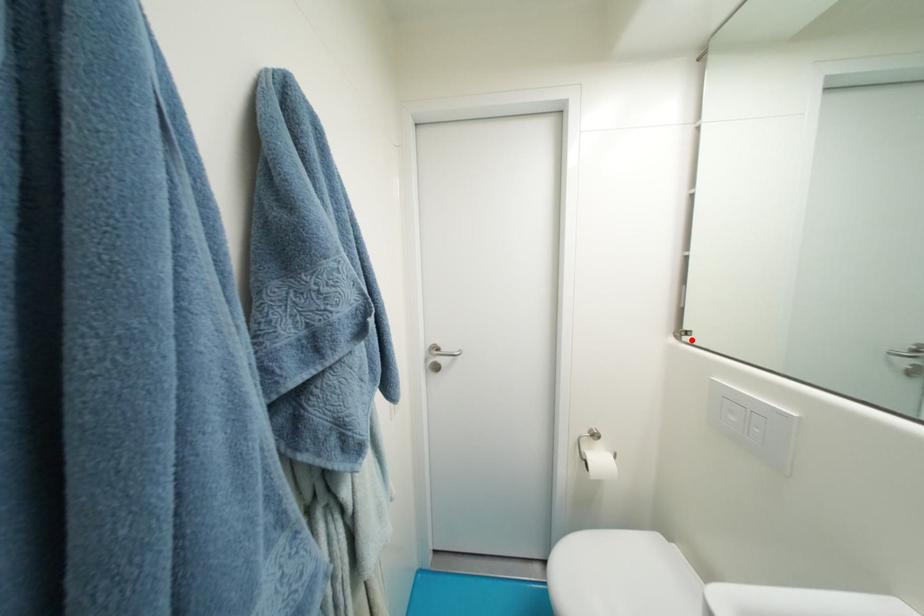
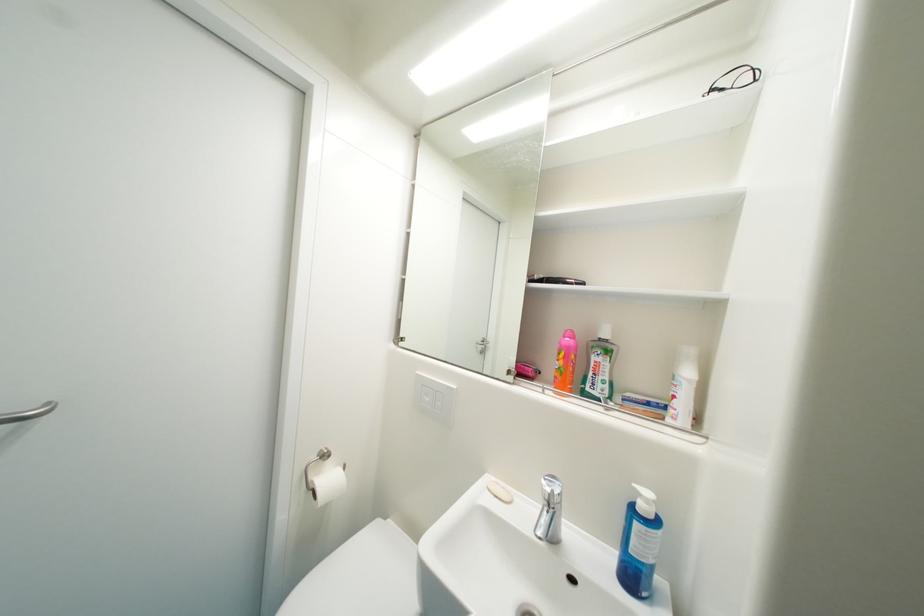
Where in the second image is the point corresponding to the highlighted location from the first image?

(407, 345)